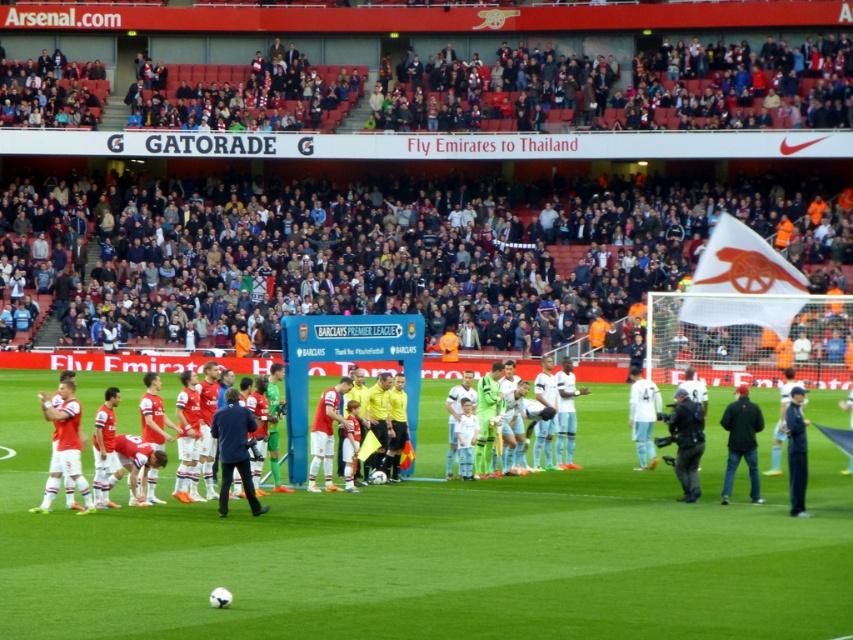
Can you confirm if white fabric crowd at upper center is taller than white jersey at left?

Yes, white fabric crowd at upper center is taller than white jersey at left.

Is white fabric crowd at upper center shorter than white jersey at left?

No, white fabric crowd at upper center is not shorter than white jersey at left.

Where is `white fabric crowd at upper center`? This screenshot has height=640, width=853. white fabric crowd at upper center is located at coordinates (373, 253).

Where is `white fabric crowd at upper center`? The image size is (853, 640). white fabric crowd at upper center is located at coordinates (373, 253).

Is white fabric flag at right further to camera compared to white jersey at left?

Yes, white fabric flag at right is further from the viewer.

Can you confirm if white fabric flag at right is thinner than white jersey at left?

Yes.

Which is in front, point (770, 289) or point (55, 467)?

Positioned in front is point (55, 467).

Locate an element on the screen. The height and width of the screenshot is (640, 853). white fabric flag at right is located at coordinates (741, 282).

Does green grass at center have a greater height compared to white jersey at left?

In fact, green grass at center may be shorter than white jersey at left.

In order to click on green grass at center in this screenshot , I will do `click(434, 550)`.

This screenshot has height=640, width=853. What do you see at coordinates (434, 550) in the screenshot?
I see `green grass at center` at bounding box center [434, 550].

I want to click on green grass at center, so tap(434, 550).